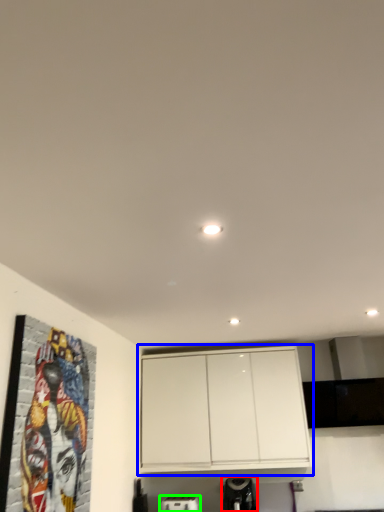
Question: Estimate the real-world distances between objects in this image. Which object is farther from appliance (highlighted by a red box), cabinetry (highlighted by a blue box) or appliance (highlighted by a green box)?

Choices:
 (A) cabinetry
 (B) appliance

Answer: (A)